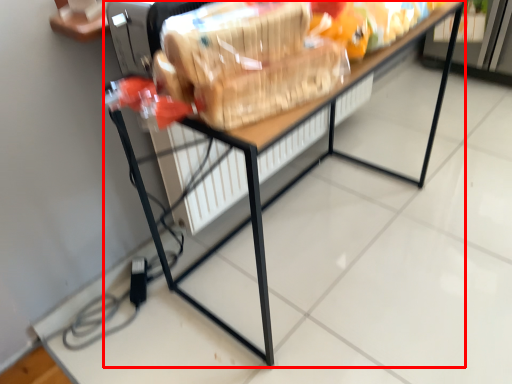
Question: From the image's perspective, where is table (annotated by the red box) located in relation to stuff in the image?

Choices:
 (A) below
 (B) above

Answer: (A)